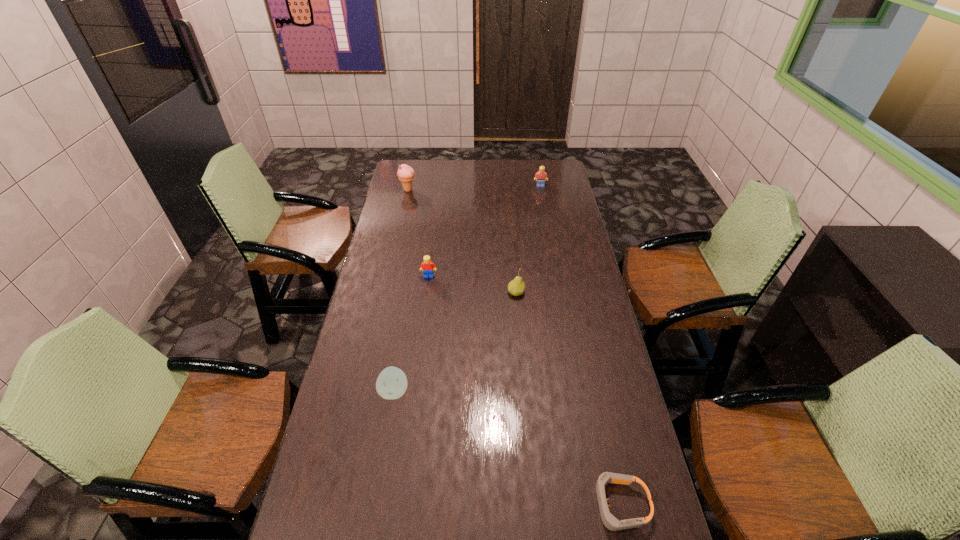
The width and height of the screenshot is (960, 540). I want to click on free space located on the front of the icecream, so click(x=404, y=205).

Where is `vacant space located 0.050m on the front-facing side of the farther Lego`? vacant space located 0.050m on the front-facing side of the farther Lego is located at coordinates (541, 193).

The image size is (960, 540). Find the location of `vacant space located on the front of the fourth object from left to right`. vacant space located on the front of the fourth object from left to right is located at coordinates (524, 392).

This screenshot has width=960, height=540. Identify the location of vacant area situated 0.110m on the face of the nearer Lego. (426, 299).

Locate an element on the screen. free region located 0.350m on the back of the apple is located at coordinates (409, 300).

Image resolution: width=960 pixels, height=540 pixels. Identify the location of vacant area located 0.400m on the front and back of the shortest object. (432, 504).

You are a GUI agent. You are given a task and a screenshot of the screen. Output one action in this format:
    pyautogui.click(x=<x>, y=<y>)
    Task: Click on the vacant space located 0.330m on the front and back of the shortest object
    Image resolution: width=960 pixels, height=540 pixels.
    Given the screenshot: What is the action you would take?
    pyautogui.click(x=460, y=504)

At what (x,y) coordinates should I click in order to perform the action: click on blank space located 0.400m on the front and back of the shortest object. Please return your answer as a coordinate pair (x, y). The width and height of the screenshot is (960, 540). Looking at the image, I should click on (432, 504).

Find the location of `icecream at the left edge`. icecream at the left edge is located at coordinates (405, 173).

At what (x,y) coordinates should I click in order to perform the action: click on apple located in the left edge section of the desktop. Please return your answer as a coordinate pair (x, y). The image size is (960, 540). Looking at the image, I should click on (391, 383).